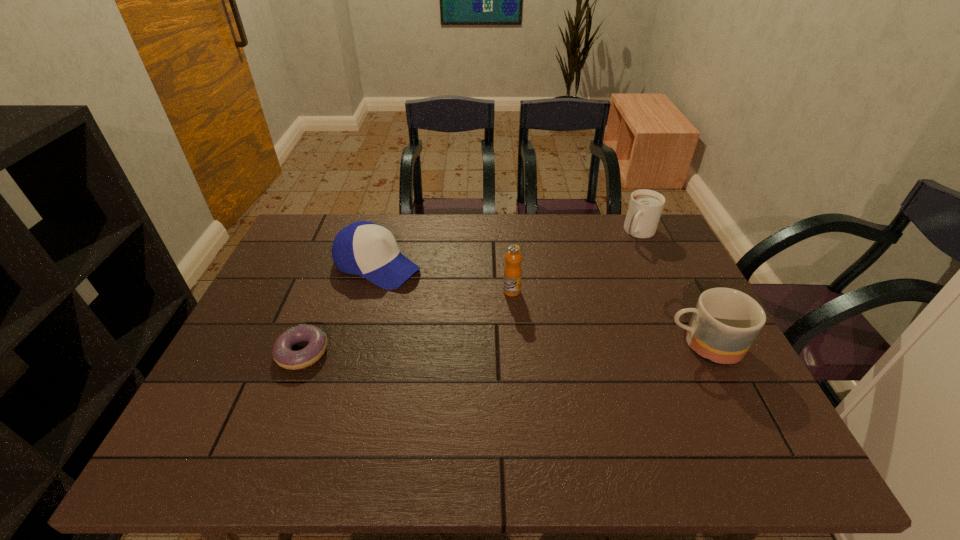
Locate an element on the screen. vacant region located on the side with the handle of the cappuccino is located at coordinates (589, 307).

The width and height of the screenshot is (960, 540). In order to click on free spot located on the side with the handle of the cappuccino in this screenshot , I will do `click(629, 251)`.

Find the location of a particular element. The width and height of the screenshot is (960, 540). free space located on the front-facing side of the baseball cap is located at coordinates (431, 291).

You are a GUI agent. You are given a task and a screenshot of the screen. Output one action in this format:
    pyautogui.click(x=<x>, y=<y>)
    Task: Click on the vacant space situated 0.120m on the front-facing side of the baseball cap
    The width and height of the screenshot is (960, 540).
    Given the screenshot: What is the action you would take?
    pyautogui.click(x=443, y=296)

Identify the location of blank area located 0.370m on the front-facing side of the baseball cap. The height and width of the screenshot is (540, 960). [x=516, y=334].

I want to click on blank space located on the front label of the third object from left to right, so [x=546, y=402].

Find the location of a particular element. free spot located 0.070m on the front label of the third object from left to right is located at coordinates (519, 314).

You are a GUI agent. You are given a task and a screenshot of the screen. Output one action in this format:
    pyautogui.click(x=<x>, y=<y>)
    Task: Click on the free region located 0.360m on the front label of the third object from left to right
    The height and width of the screenshot is (540, 960).
    Given the screenshot: What is the action you would take?
    pyautogui.click(x=547, y=406)

Locate an element on the screen. cappuccino located in the far edge section of the desktop is located at coordinates (645, 207).

Find the location of a particular element. The image size is (960, 540). baseball cap that is at the far edge is located at coordinates (363, 248).